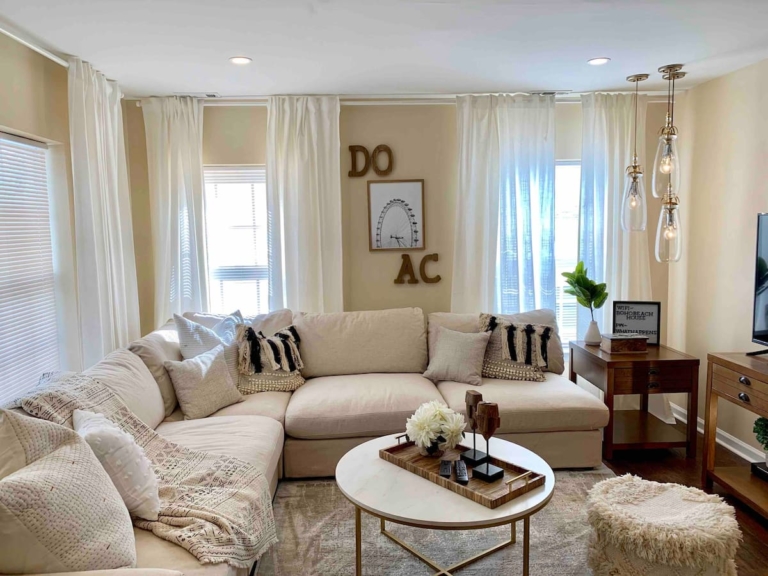
Identify the location of pillow. The width and height of the screenshot is (768, 576). (81, 511), (127, 463), (213, 376), (230, 337), (266, 352), (458, 353), (520, 369).